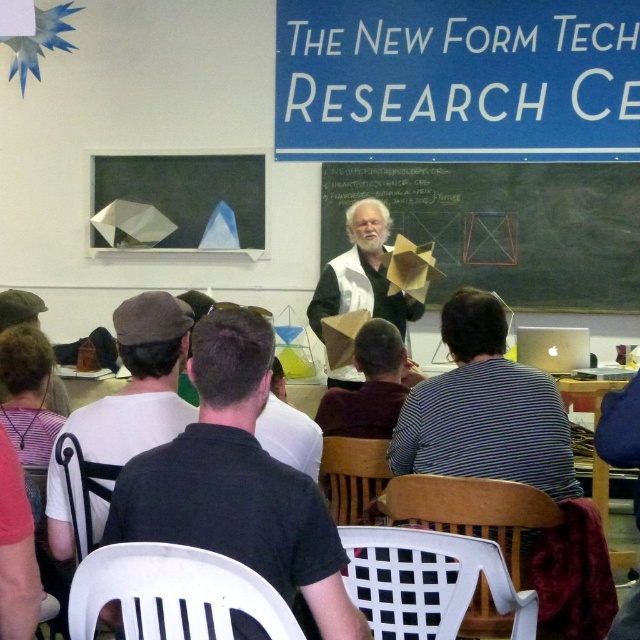
Question: Is matte black chalkboard at center smaller than white matte vest at center?

Choices:
 (A) no
 (B) yes

Answer: (A)

Question: Does dark gray fabric cap at lower left appear over white matte vest at center?

Choices:
 (A) yes
 (B) no

Answer: (B)

Question: Which object is positioned farthest from the dark gray fabric cap at lower left?

Choices:
 (A) black shirt at center
 (B) white matte vest at center
 (C) striped shirt at center

Answer: (B)

Question: Considering the relative positions of striped shirt at center and dark gray fabric cap at lower left in the image provided, where is striped shirt at center located with respect to dark gray fabric cap at lower left?

Choices:
 (A) left
 (B) right

Answer: (B)

Question: Which of the following is the closest to the observer?

Choices:
 (A) matte black chalkboard at center
 (B) black shirt at center
 (C) dark brown leather hat at lower left
 (D) dark gray fabric cap at lower left

Answer: (B)

Question: Among these points, which one is farthest from the camera?

Choices:
 (A) (147, 440)
 (B) (337, 280)
 (C) (4, 310)

Answer: (B)